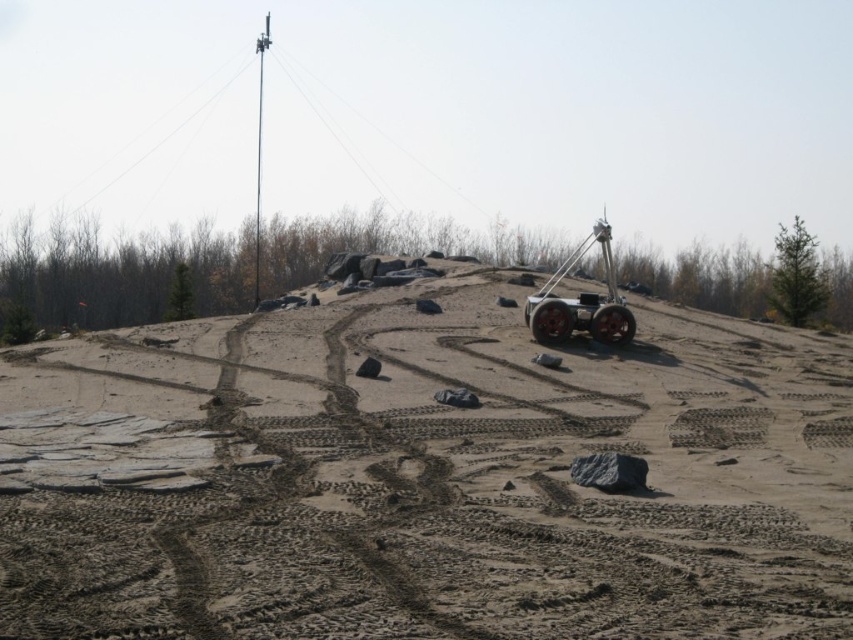
Question: Does black rubber tire at center have a greater width compared to rubber/textured tire at center-right?

Choices:
 (A) yes
 (B) no

Answer: (B)

Question: Is metallic red rover at upper right below black rubber tire at center?

Choices:
 (A) no
 (B) yes

Answer: (A)

Question: Which object appears closest to the camera in this image?

Choices:
 (A) brown sandy terrain at center
 (B) rubber/textured tire at center-right
 (C) metallic red rover at upper right

Answer: (A)

Question: Which object appears farthest from the camera in this image?

Choices:
 (A) metallic red rover at upper right
 (B) rubber/textured tire at center-right

Answer: (B)

Question: Which of these objects is positioned closest to the brown sandy terrain at center?

Choices:
 (A) rubber/textured tire at center-right
 (B) metallic red rover at upper right
 (C) black rubber tire at center

Answer: (C)

Question: Does metallic red rover at upper right lie behind black rubber tire at center?

Choices:
 (A) yes
 (B) no

Answer: (A)